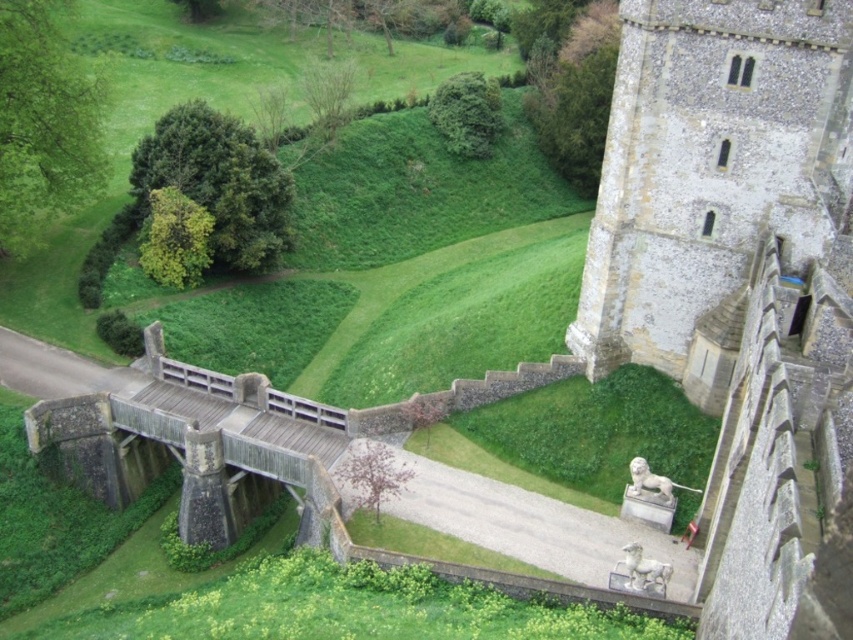
You are a visitor approaching the stone tower at right and wooden bridge at lower left. Which object would you see first as you approach the structure from the lower left side?

The wooden bridge at lower left would be seen first because it is positioned lower and closer to the approach path, while the stone tower at right is situated higher and further away.

You are standing on the stone bridge with a wooden walkway looking towards the historic stone structure. There are two points marked on the image, point 1 at coordinates (x=844, y=8) and point 2 at (x=100, y=456). Which point is closer to your current position on the bridge?

Point 1 at coordinates (x=844, y=8) is closer to your current position on the bridge because it is closer to the camera, which represents your viewpoint.

You are a visitor approaching the historic stone structure. You notice a specific point marked at coordinates (x=714, y=179). Based on the scene, where is this point located?

The point at coordinates (x=714, y=179) is located on the stone tower at the right side of the structure.